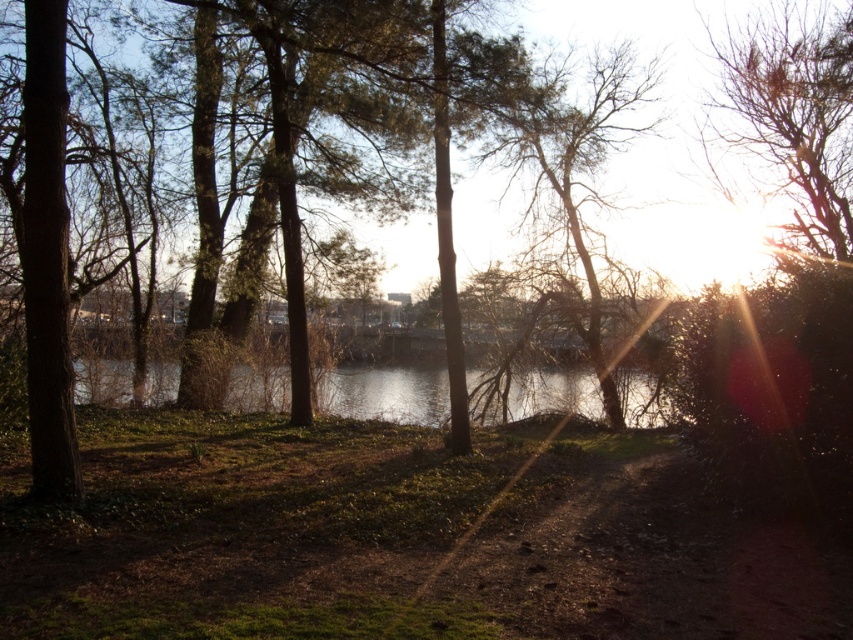
Question: Can you confirm if bare branches at upper right is positioned to the right of bare branches at upper center?

Choices:
 (A) yes
 (B) no

Answer: (A)

Question: Does bare branches at upper right come behind bare branches at upper center?

Choices:
 (A) no
 (B) yes

Answer: (B)

Question: Which point appears closest to the camera in this image?

Choices:
 (A) (817, 225)
 (B) (547, 392)

Answer: (B)

Question: From the image, what is the correct spatial relationship of bare branches at upper center in relation to clear water at center?

Choices:
 (A) above
 (B) below

Answer: (A)

Question: Among these points, which one is nearest to the camera?

Choices:
 (A) (546, 122)
 (B) (113, 381)
 (C) (811, 237)

Answer: (A)

Question: Which object is positioned farthest from the bare branches at upper right?

Choices:
 (A) bare branches at upper center
 (B) clear water at center

Answer: (B)